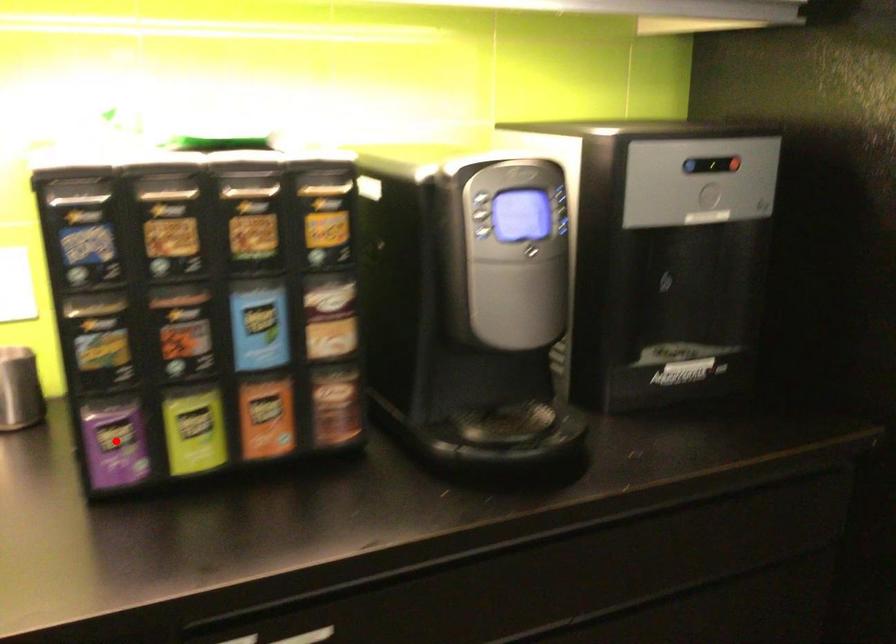
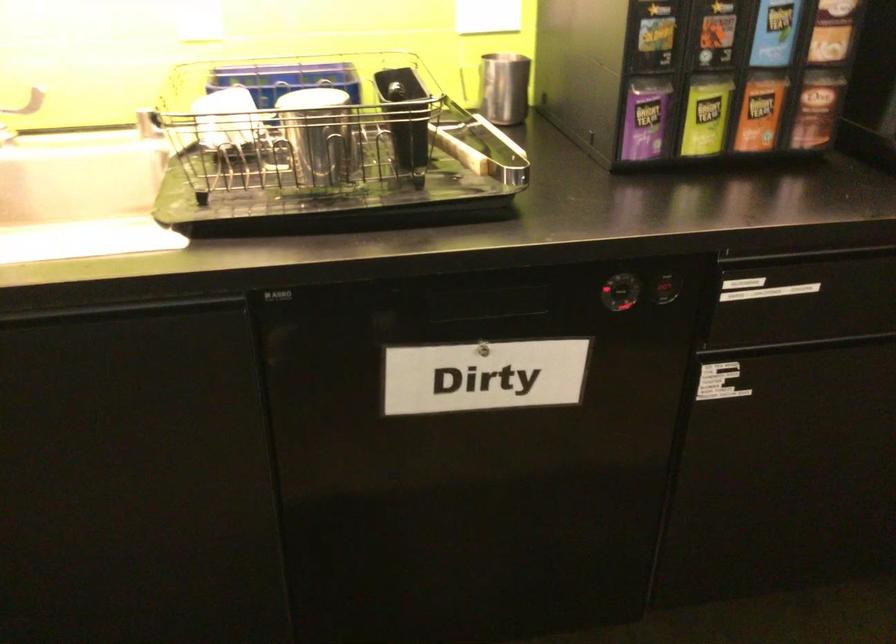
The point at the highlighted location is marked in the first image. Where is the corresponding point in the second image?

(645, 118)